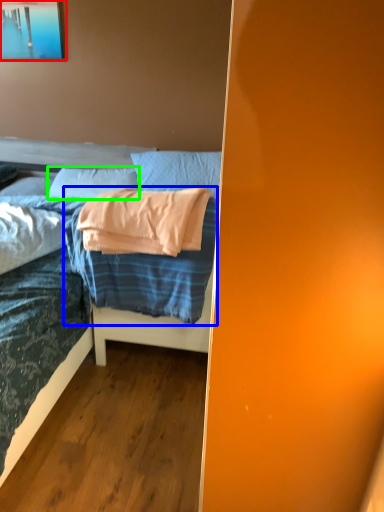
Question: Which object is the farthest from picture frame (highlighted by a red box)? Choose among these: blanket (highlighted by a blue box) or pillow (highlighted by a green box).

Choices:
 (A) blanket
 (B) pillow

Answer: (A)